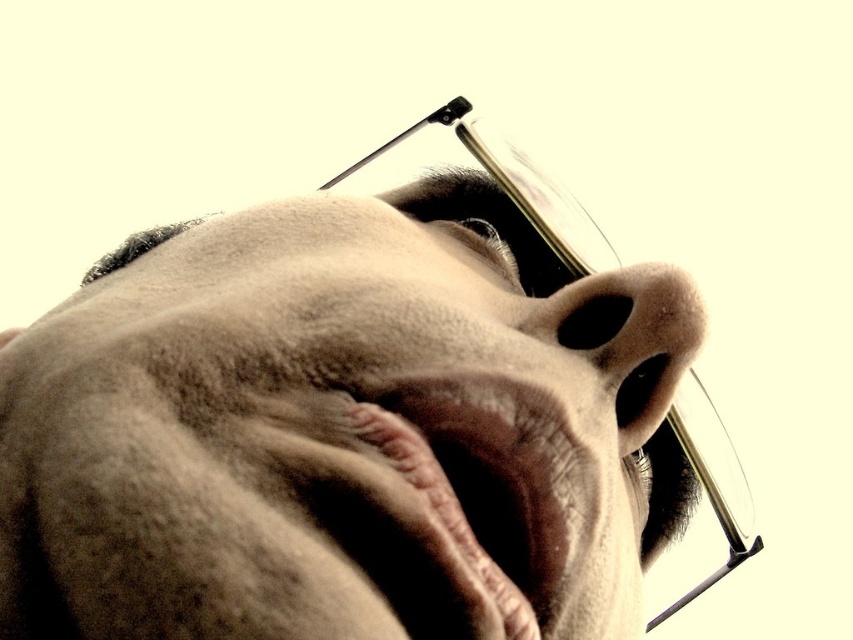
Question: Is matte skin face at center wider than dry skin at center?

Choices:
 (A) yes
 (B) no

Answer: (A)

Question: Does dry skin at center have a greater width compared to smooth skin nose at center?

Choices:
 (A) no
 (B) yes

Answer: (B)

Question: Does matte skin face at center appear on the left side of dry skin at center?

Choices:
 (A) no
 (B) yes

Answer: (B)

Question: Which point is farther to the camera?

Choices:
 (A) smooth skin nose at center
 (B) matte skin face at center
 (C) dry skin at center

Answer: (A)

Question: Which point appears farthest from the camera in this image?

Choices:
 (A) (45, 476)
 (B) (631, 268)
 (C) (465, 394)

Answer: (B)

Question: Which of the following is the closest to the observer?

Choices:
 (A) (665, 307)
 (B) (679, 380)
 (C) (531, 556)

Answer: (C)